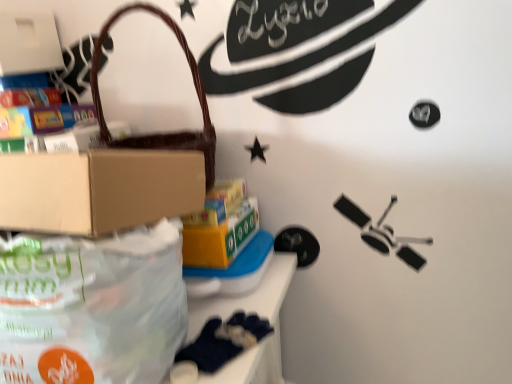
Question: From the image's perspective, is yellow cardboard box at center, the first box ordered from the bottom, positioned above or below white matte box at upper left, which is counted as the second box, starting from the right?

Choices:
 (A) above
 (B) below

Answer: (B)

Question: In the image, is yellow cardboard box at center, placed as the 2th box when sorted from left to right, on the left side or the right side of white matte box at upper left, which is counted as the second box, starting from the right?

Choices:
 (A) right
 (B) left

Answer: (A)

Question: Estimate the real-world distances between objects in this image. Which object is farther from the brown woven handbag at upper left?

Choices:
 (A) yellow cardboard box at center, which is counted as the 1th box, starting from the right
 (B) white matte box at upper left, marked as the 1th box in a top-to-bottom arrangement
 (C) translucent plastic bag at lower left
 (D) dark blue fabric at lower left

Answer: (D)

Question: Based on their relative distances, which object is farther from the white matte box at upper left, marked as the 1th box in a top-to-bottom arrangement?

Choices:
 (A) brown woven handbag at upper left
 (B) translucent plastic bag at lower left
 (C) yellow cardboard box at center, which appears as the second box when viewed from the top
 (D) dark blue fabric at lower left

Answer: (D)